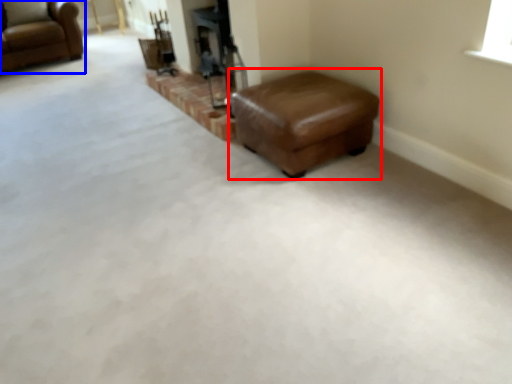
Question: Which object is further to the camera taking this photo, stool (highlighted by a red box) or chair (highlighted by a blue box)?

Choices:
 (A) stool
 (B) chair

Answer: (B)